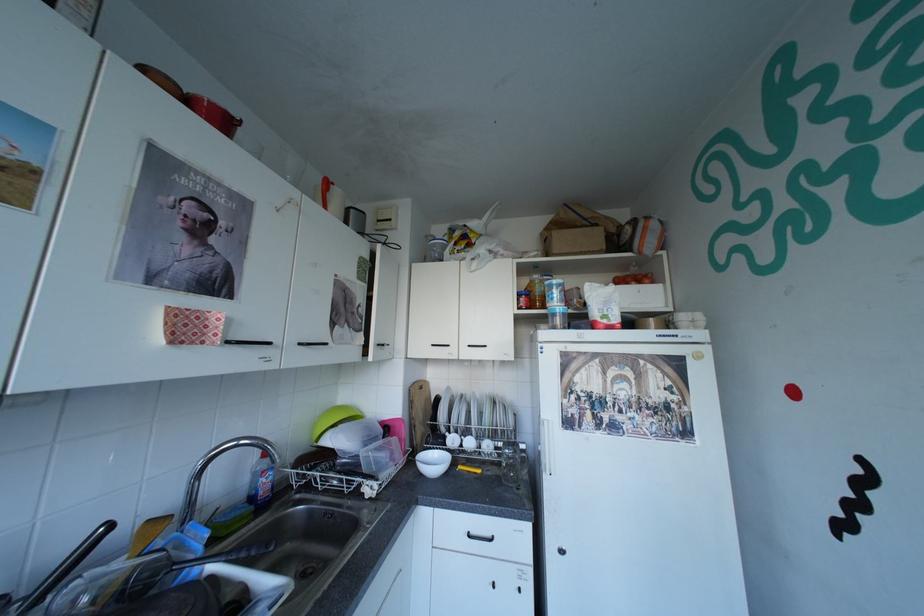
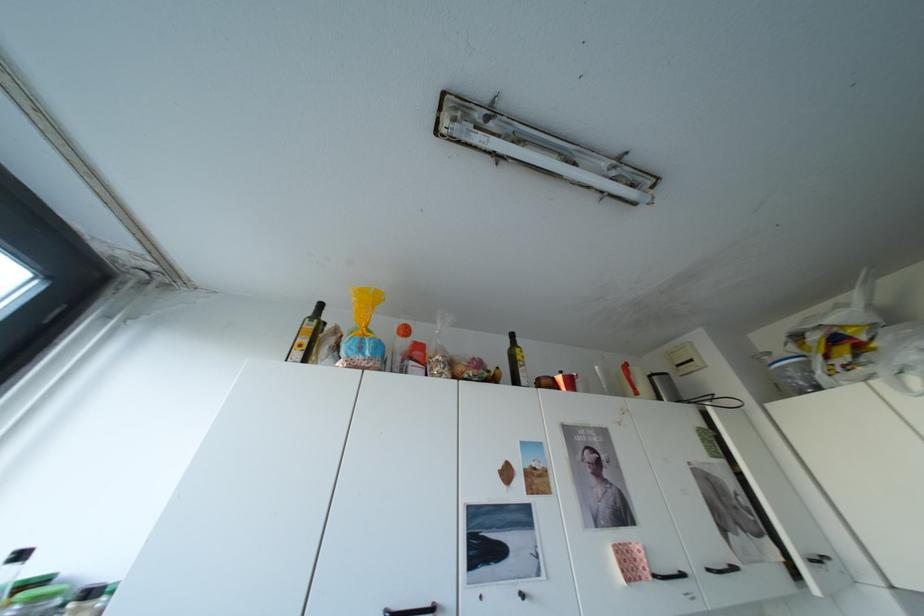
The point at (x=199, y=330) is marked in the first image. Where is the corresponding point in the second image?

(642, 568)